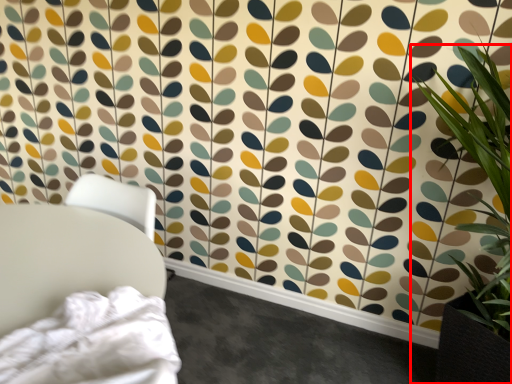
Question: From the image's perspective, considering the relative positions of houseplant (annotated by the red box) and furniture in the image provided, where is houseplant (annotated by the red box) located with respect to the staircase?

Choices:
 (A) above
 (B) below

Answer: (A)